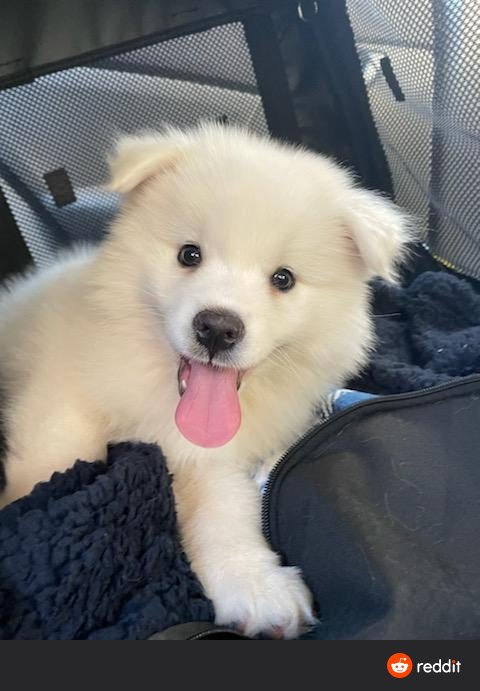
I want to click on mesh screen, so click(x=464, y=28), click(x=109, y=74).